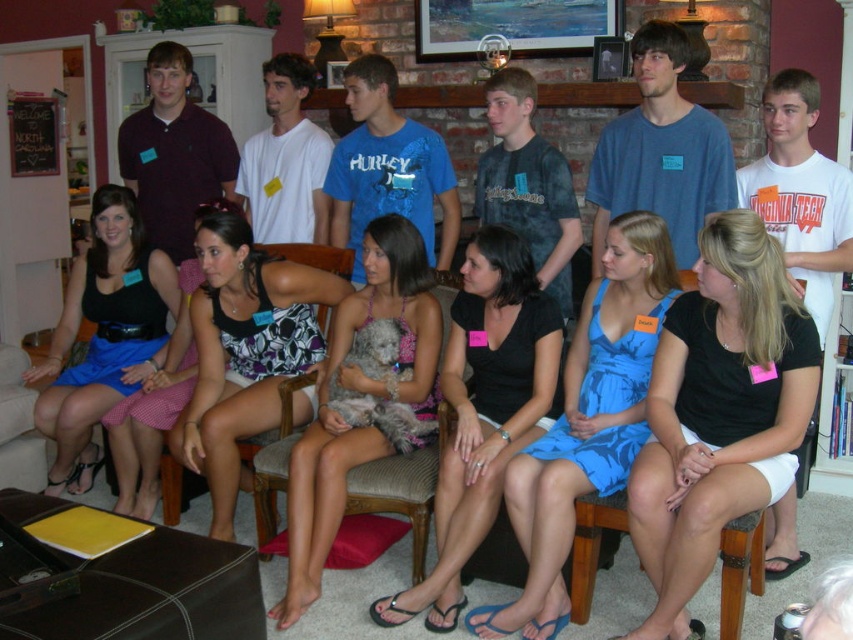
Does blue cotton shirt at upper center come behind matte maroon polo shirt at upper left?

No, blue cotton shirt at upper center is closer to the viewer.

Looking at this image, who is more distant from viewer, (695, 227) or (222, 148)?

The point (222, 148) is more distant.

Between point (633, 122) and point (142, 180), which one is positioned in front?

Point (633, 122) is in front.

At what (x,y) coordinates should I click in order to perform the action: click on blue cotton shirt at upper center. Please return your answer as a coordinate pair (x, y). Looking at the image, I should click on (660, 150).

Between point (242, 392) and point (61, 353), which one is positioned in front?

Positioned in front is point (242, 392).

Between point (254, 259) and point (82, 365), which one is positioned in front?

Point (254, 259) is in front.

Where is `printed fabric tank top at center`? The height and width of the screenshot is (640, 853). printed fabric tank top at center is located at coordinates (244, 349).

Does black matte dress at center appear under matte black dress at left?

Correct, black matte dress at center is located below matte black dress at left.

Does point (659, 412) come farther from viewer compared to point (67, 472)?

No, it is in front of (67, 472).

Find the location of `black matte dress at center`. black matte dress at center is located at coordinates tap(718, 412).